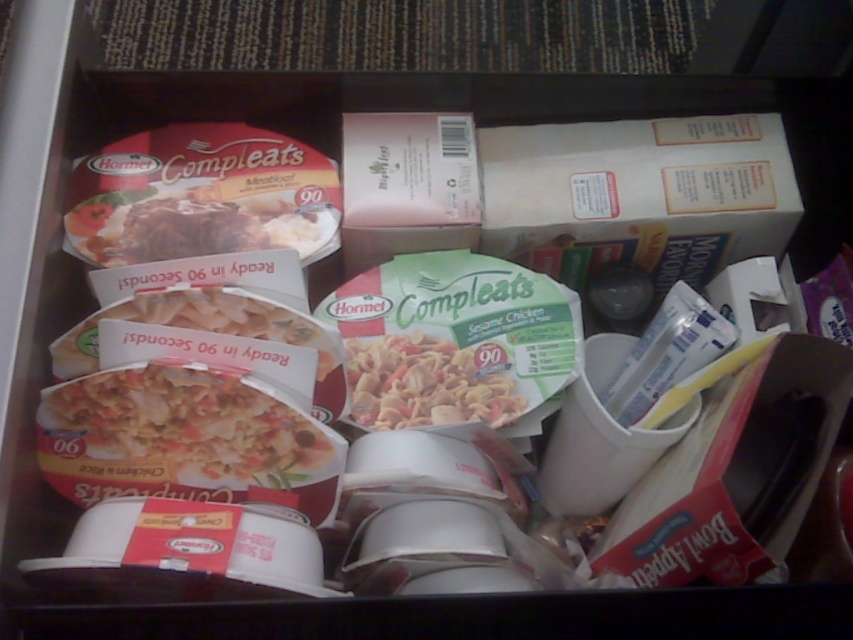
You are organizing a pantry and need to stack items vertically. You have a matte plastic compleats meal at center and a green matte compleats bowl at center. Which item should you place at the bottom to ensure stability?

The matte plastic compleats meal at center is positioned over the green matte compleats bowl at center, so to ensure stability, place the green matte compleats bowl at center at the bottom.

You are organizing a pantry and need to stack items vertically. You have a white matte compleats at center and a matte plastic compleats meal at center. Which item should you place at the bottom to ensure stability?

The white matte compleats at center should be placed at the bottom because it has a larger size compared to the matte plastic compleats meal at center, providing a more stable base.